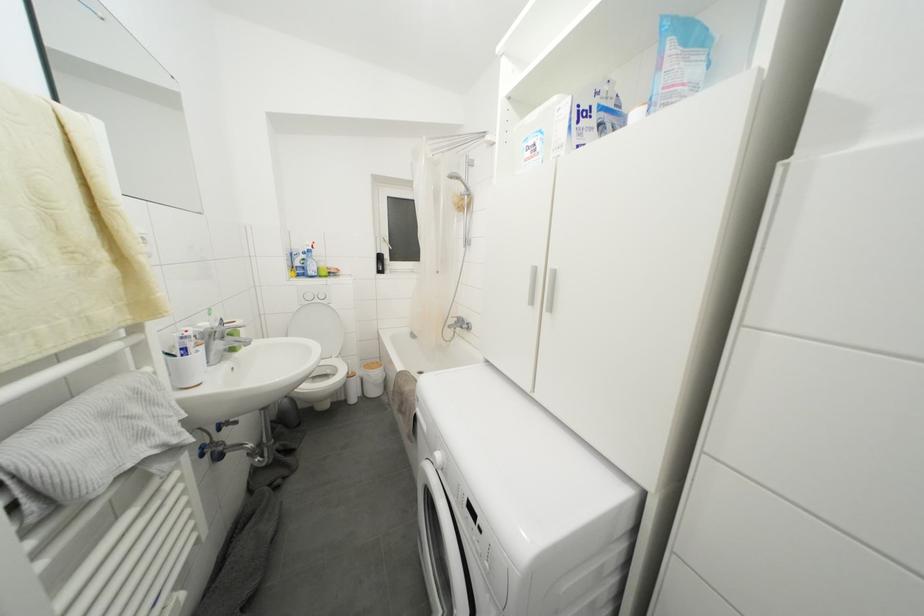
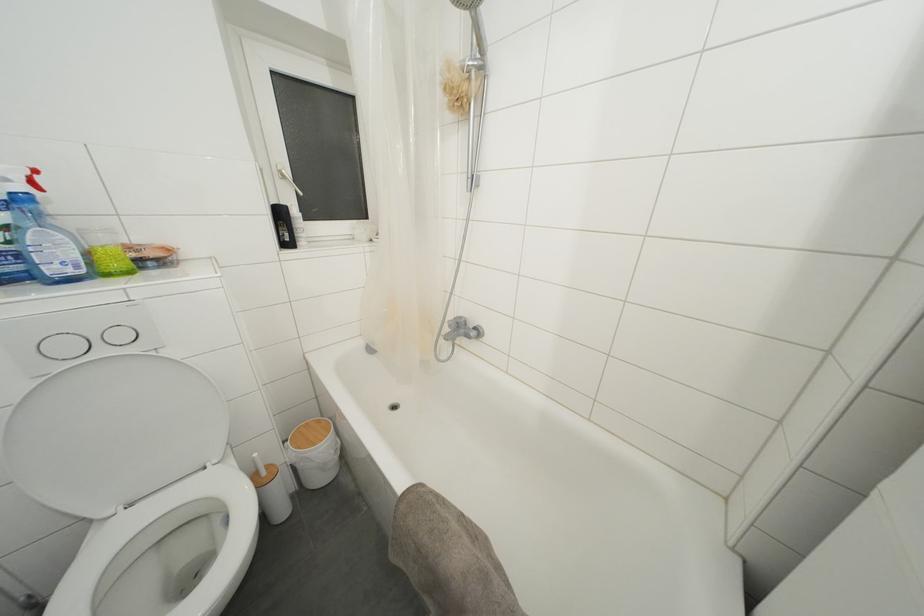
The point at [321,305] is marked in the first image. Where is the corresponding point in the second image?

(106, 357)